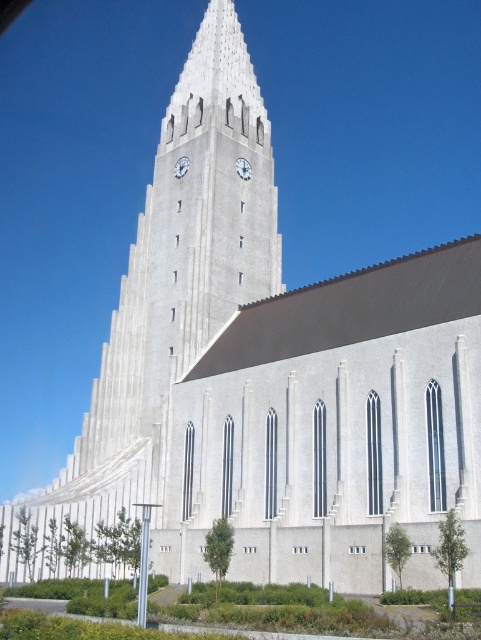
Which is behind, point (241, 156) or point (176, 172)?

The point (241, 156) is behind.

Between white metallic clock at upper center and white glossy clock at upper center, which one appears on the left side from the viewer's perspective?

From the viewer's perspective, white glossy clock at upper center appears more on the left side.

Between point (239, 173) and point (177, 164), which one is positioned behind?

The point (177, 164) is more distant.

This screenshot has height=640, width=481. What are the coordinates of `white metallic clock at upper center` in the screenshot? It's located at (243, 168).